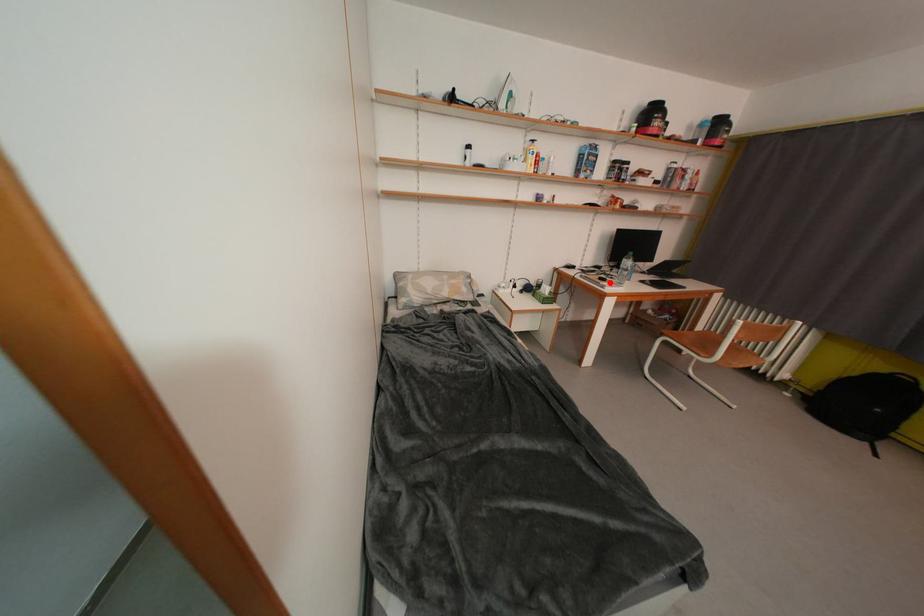
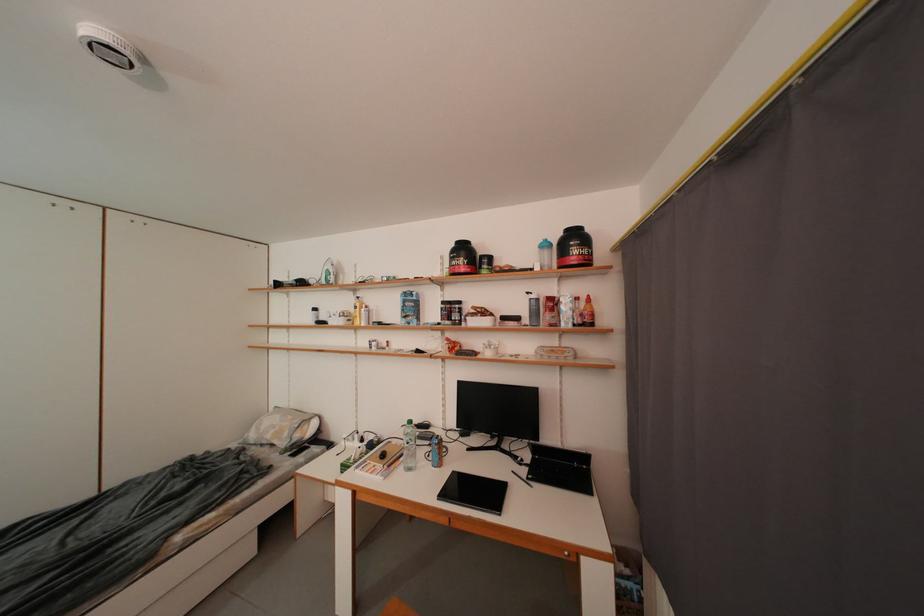
Question: I am providing you with two images of the same scene from different viewpoints. Given a red point in image1, look at the same physical point in image2. Is it:

Choices:
 (A) Closer to the viewpoint
 (B) Farther from the viewpoint

Answer: (B)